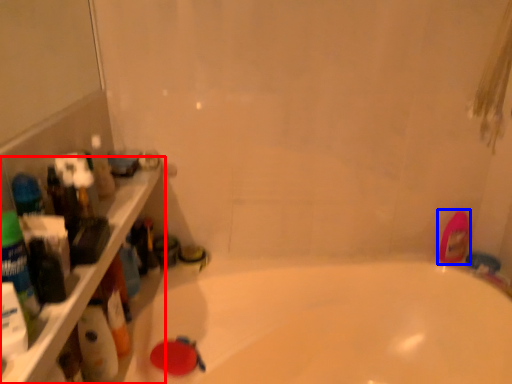
Question: Which object appears farthest to the camera in this image, ledge (highlighted by a red box) or mouthwash (highlighted by a blue box)?

Choices:
 (A) ledge
 (B) mouthwash

Answer: (B)